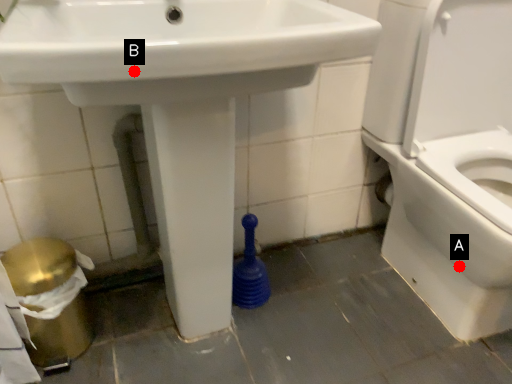
Question: Two points are circled on the image, labeled by A and B beside each circle. Which point is closer to the camera?

Choices:
 (A) A is closer
 (B) B is closer

Answer: (B)